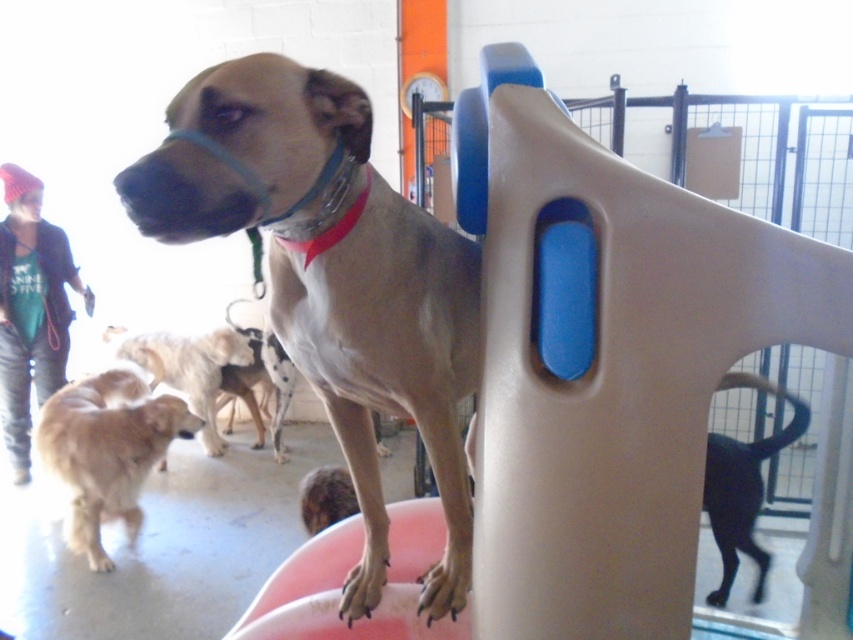
You are a trainer observing the scene. You notice the light brown fur at center and the black glossy dog at lower right. Which one is closer to you?

The light brown fur at center is closer to you because it is in front of the black glossy dog at lower right.

You are a photographer setting up a shoot in the dog training facility. You need to position a light source so that it illuminates both the light brown fur at center and the golden fur dog at lower left equally. Considering their sizes, which dog requires the light to be placed closer to it?

The light brown fur at center requires the light to be placed closer to it because it occupies less space than the golden fur dog at lower left.